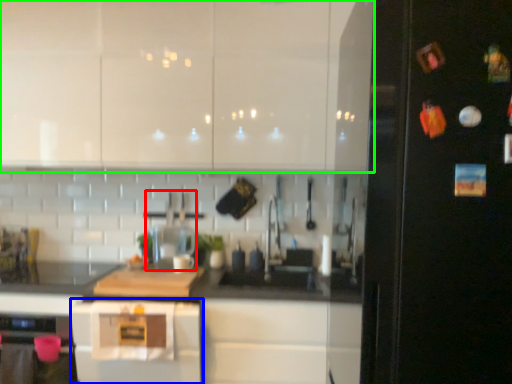
Question: Which object is the farthest from appliance (highlighted by a red box)? Choose among these: home appliance (highlighted by a blue box) or cabinetry (highlighted by a green box).

Choices:
 (A) home appliance
 (B) cabinetry

Answer: (B)